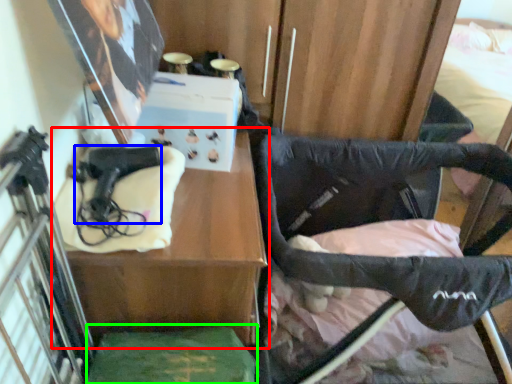
Question: Which object is positioned closest to table (highlighted by a red box)? Select from handgun (highlighted by a blue box) and wide (highlighted by a green box).

Choices:
 (A) handgun
 (B) wide

Answer: (B)